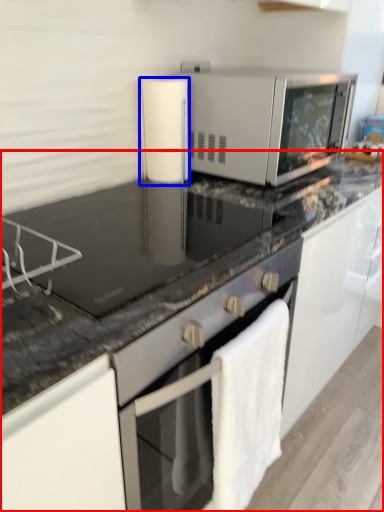
Question: Which object appears farthest to the camera in this image, countertop (highlighted by a red box) or appliance (highlighted by a blue box)?

Choices:
 (A) countertop
 (B) appliance

Answer: (B)